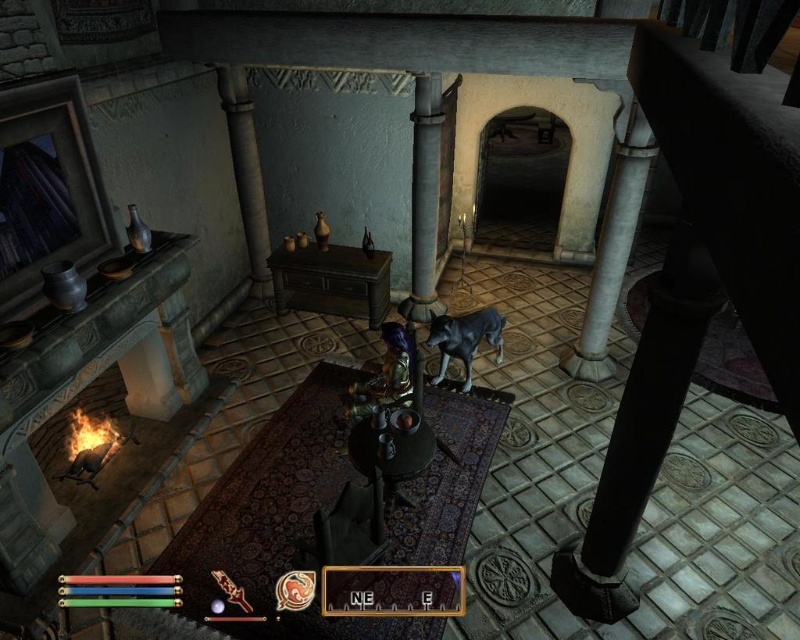
You are a game character trying to pass through the narrow space between the black polished wood pillar at right and the white marble pillar at right. Based on their widths, can you determine if you can fit through?

The black polished wood pillar at right might be wider than white marble pillar at right, so it is uncertain if you can fit through the narrow space between them without more information on their exact widths.

You are a character in this medieval game and need to reach a high shelf to retrieve an item. You see the white marble pillar at right and the gray stone pillar at center. Which pillar should you use as a stepping stool to reach the shelf?

The white marble pillar at right is much taller than the gray stone pillar at center, so you should use the white marble pillar at right as a stepping stool to reach the shelf.